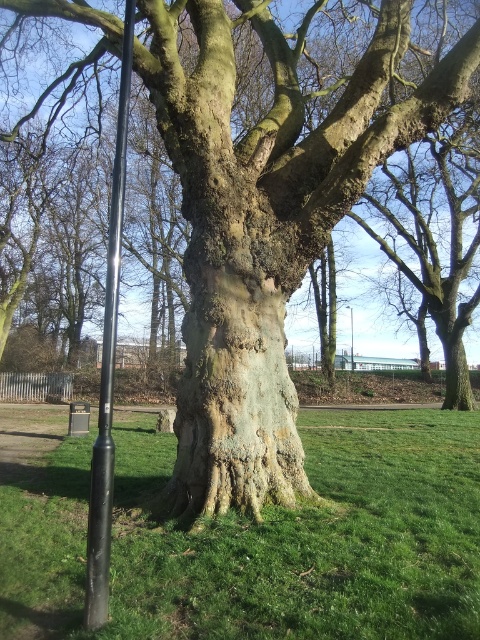
You are standing in the park and see two poles, the black matte pole at left and the black metal pole at center. Which pole would cast a longer shadow on the grass?

The black matte pole at left is closer to the viewer than the black metal pole at center, so its shadow would be longer.